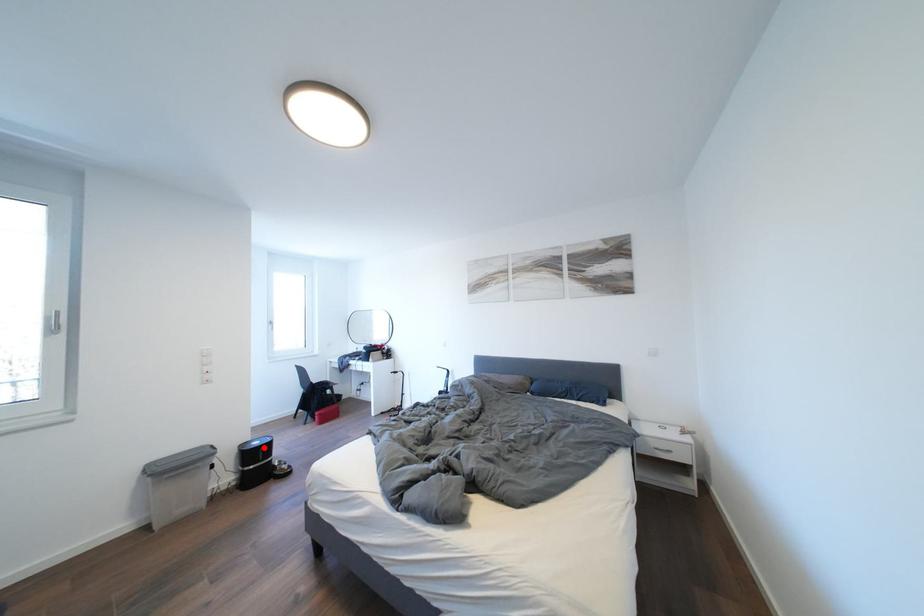
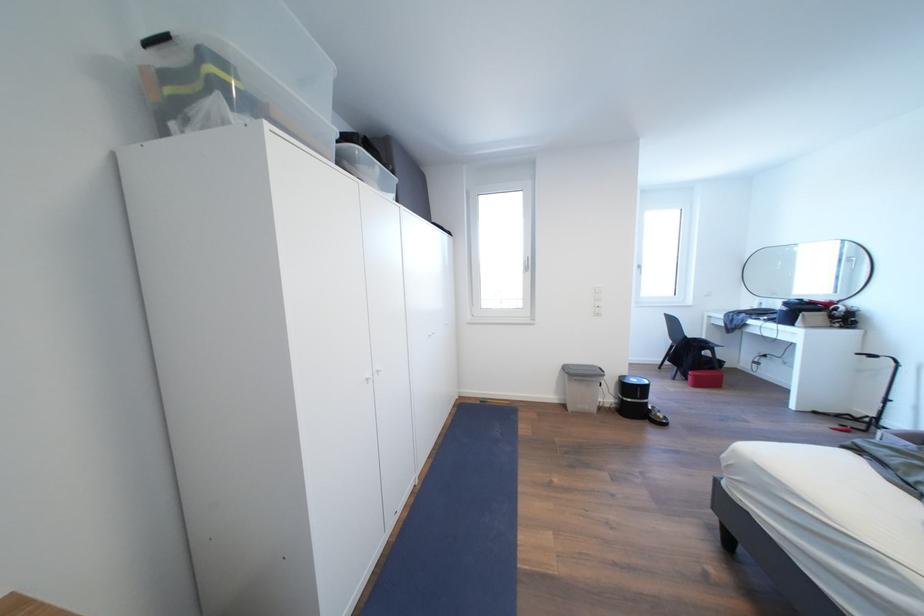
Question: A red point is marked in image1. In image2, is the corresponding 3D point closer to the camera or farther? Reply with the corresponding letter.

Choices:
 (A) The corresponding 3D point is closer.
 (B) The corresponding 3D point is farther.

Answer: (B)